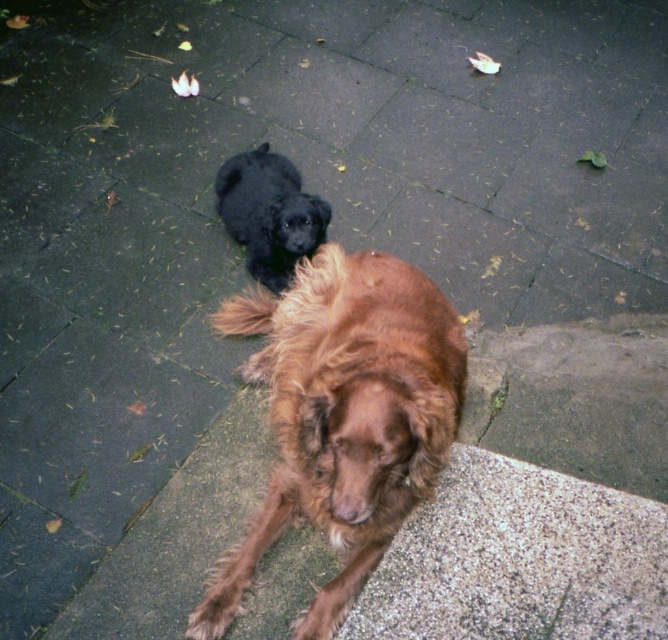
You are a photographer trying to capture both the brown furry dog at center and the shiny black fur at upper center in a single shot. Based on their sizes, which dog should you focus on first to ensure both fit in the frame?

The brown furry dog at center is larger than the shiny black fur at upper center, so focusing on the brown furry dog at center first will help ensure both fit in the frame.

Based on the scene description, where is the brown furry dog at center located in terms of coordinates?

The brown furry dog at center is located at point coordinates of (343, 417).